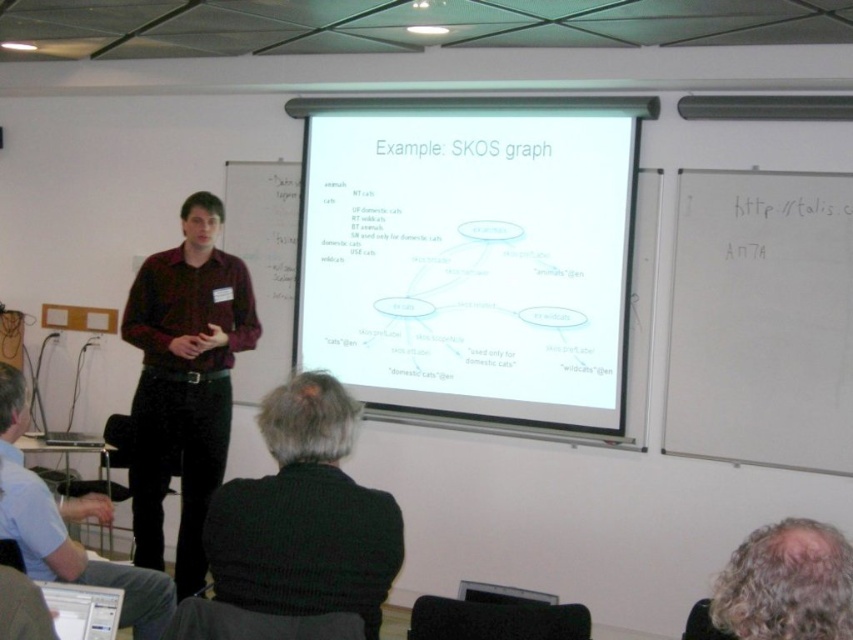
You are standing at the viewer position in the conference room. There is a point marked at coordinates (x=323, y=236). Can you reach that point without moving your feet?

The point at (x=323, y=236) is 4.28 meters away from you, so you cannot reach it without moving your feet.

You are an attendee in the presentation and you see the point at (469, 260) on the white paper at center. Can you tell me what the point is pointing to on the white paper at center?

The point at (469, 260) is on white paper at center, so it is pointing to the white paper at center.

You are a participant in the presentation and need to retrieve the dark brown leather jacket at lower left from its current position to the white paper at center. How much distance do you need to cover?

The distance between the white paper at center and the dark brown leather jacket at lower left is 6.68 feet, so you need to cover 6.68 feet to move the jacket from its current position to the white paper at center.